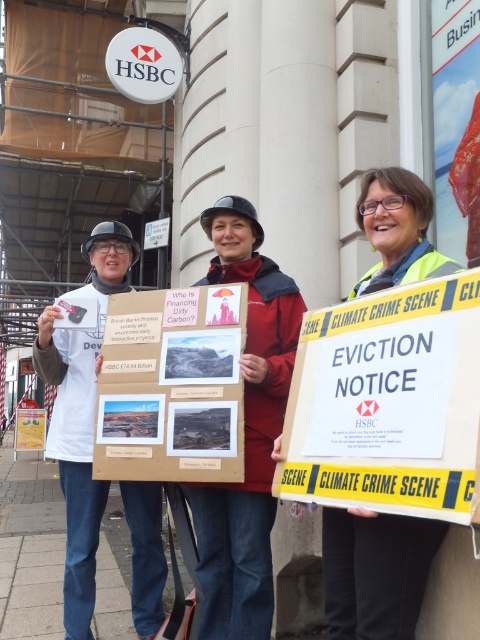
In the scene shown: Is red fabric coat at center above wooden board at center?

Indeed, red fabric coat at center is positioned over wooden board at center.

Based on the photo, is red fabric coat at center shorter than wooden board at center?

In fact, red fabric coat at center may be taller than wooden board at center.

Between point (245, 554) and point (17, 442), which one is positioned behind?

Positioned behind is point (17, 442).

At what (x,y) coordinates should I click in order to perform the action: click on red fabric coat at center. Please return your answer as a coordinate pair (x, y). The height and width of the screenshot is (640, 480). Looking at the image, I should click on (245, 433).

Is the position of white paperboard at left less distant than that of yellow reflective vest at center?

No, it is behind yellow reflective vest at center.

Who is higher up, white paperboard at left or yellow reflective vest at center?

white paperboard at left is higher up.

Measure the distance between point (54,435) and camera.

Point (54,435) is 3.32 meters away from camera.

Where is `white paperboard at left`? The image size is (480, 640). white paperboard at left is located at coordinates (81, 417).

Which is behind, point (285, 371) or point (88, 465)?

Point (88, 465)

Looking at this image, who is higher up, red fabric coat at center or white paperboard at left?

Positioned higher is red fabric coat at center.

This screenshot has height=640, width=480. What do you see at coordinates (245, 433) in the screenshot? I see `red fabric coat at center` at bounding box center [245, 433].

The width and height of the screenshot is (480, 640). Identify the location of red fabric coat at center. (245, 433).